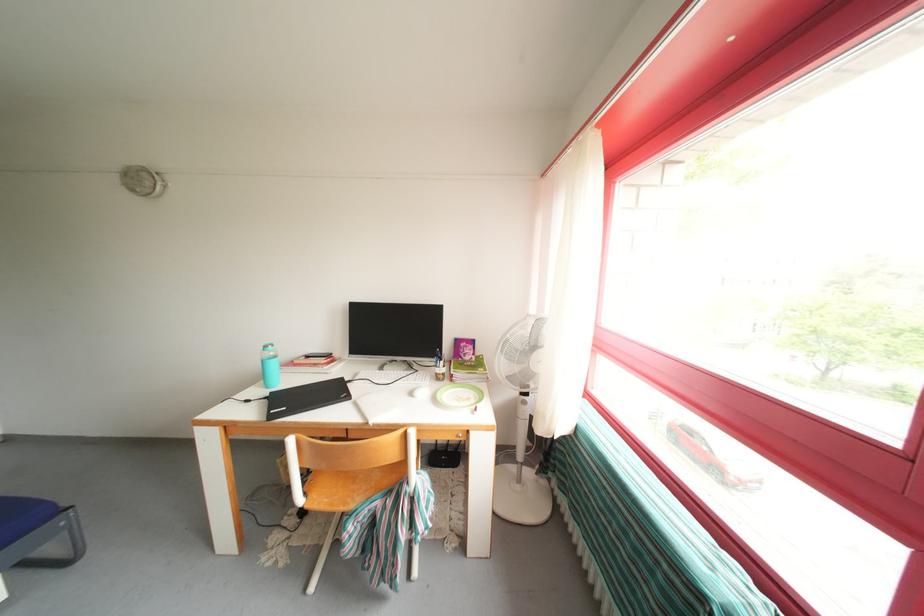
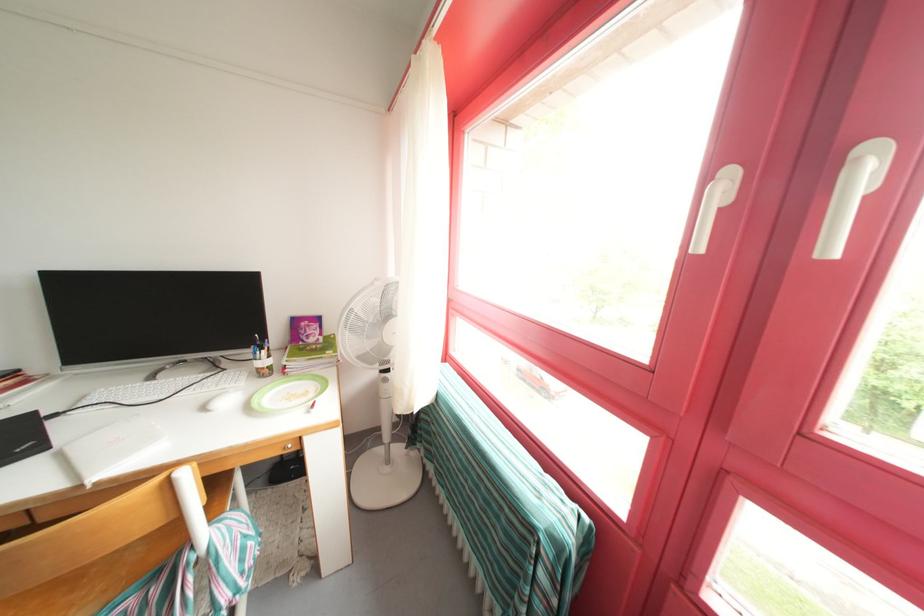
Question: Based on the continuous images, in which direction is the camera rotating? Reply with the corresponding letter.

Choices:
 (A) Left
 (B) Right
 (C) Up
 (D) Down

Answer: (B)